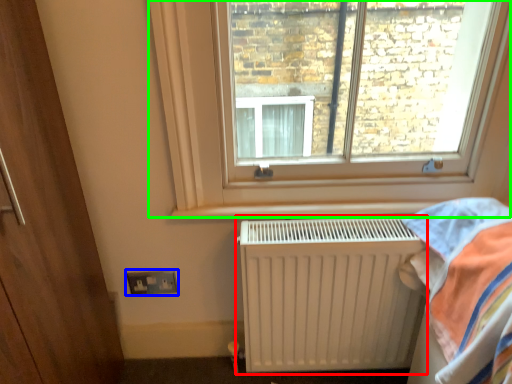
Question: Based on their relative distances, which object is nearer to radiator (highlighted by a red box)? Choose from electric outlet (highlighted by a blue box) and window (highlighted by a green box).

Choices:
 (A) electric outlet
 (B) window

Answer: (B)